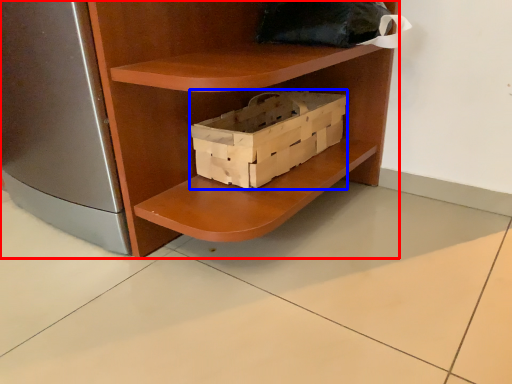
Question: Which object appears farthest to the camera in this image, shelf (highlighted by a red box) or box (highlighted by a blue box)?

Choices:
 (A) shelf
 (B) box

Answer: (B)